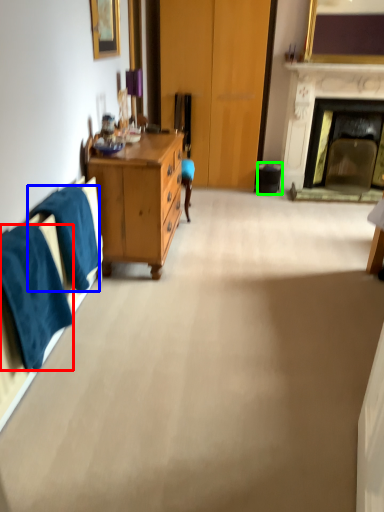
Question: Considering the real-world distances, which object is closest to towel/napkin (highlighted by a red box)? towel/napkin (highlighted by a blue box) or trash bin/can (highlighted by a green box).

Choices:
 (A) towel/napkin
 (B) trash bin/can

Answer: (A)